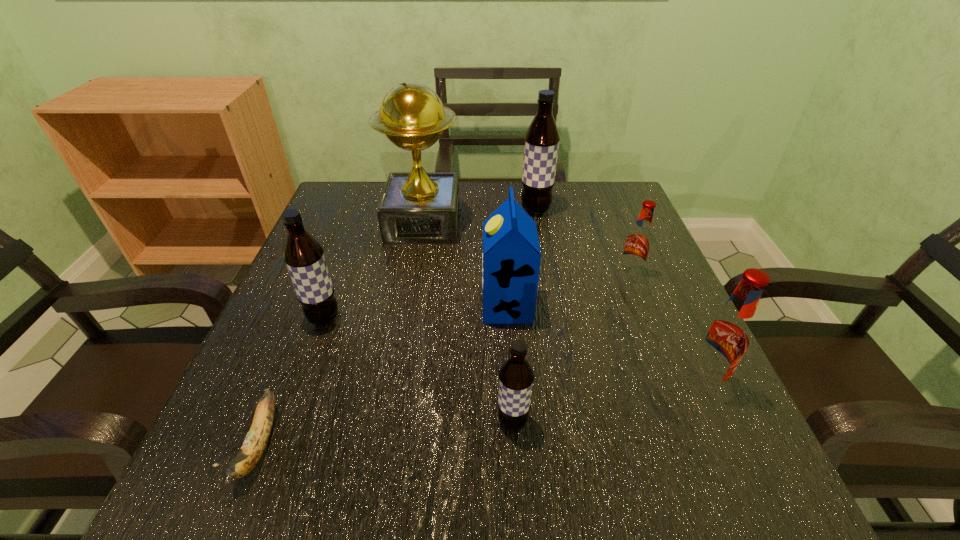
Identify the location of vacant space that is in between the third farthest object and the third root beer from right to left. Image resolution: width=960 pixels, height=540 pixels. (583, 242).

At what (x,y) coordinates should I click in order to perform the action: click on empty location between the carton and the leftmost brown root beer. Please return your answer as a coordinate pair (x, y). Looking at the image, I should click on (416, 312).

Select which object appears as the fifth closest to the leftmost root beer. Please provide its 2D coordinates. Your answer should be formatted as a tuple, i.e. [(x, y)], where the tuple contains the x and y coordinates of a point satisfying the conditions above.

[(542, 138)]

Select which object appears as the fourth closest to the shortest object. Please provide its 2D coordinates. Your answer should be formatted as a tuple, i.e. [(x, y)], where the tuple contains the x and y coordinates of a point satisfying the conditions above.

[(418, 207)]

In order to click on root beer that is the fourth closest one to the farthest root beer in this screenshot , I will do `click(516, 376)`.

What are the coordinates of `root beer that can be found as the fourth closest to the third farthest object` in the screenshot? It's located at (303, 255).

Point out which brown root beer is positioned as the nearest to the smallest brown root beer. Please provide its 2D coordinates. Your answer should be formatted as a tuple, i.e. [(x, y)], where the tuple contains the x and y coordinates of a point satisfying the conditions above.

[(303, 255)]

Locate an element on the screen. The image size is (960, 540). the second closest brown root beer to the shortest object is located at coordinates (516, 376).

Where is `vacant area in the image that satisfies the following two spatial constraints: 1. on the front side of the bigger red root beer; 2. on the right side of the third root beer from left to right`? vacant area in the image that satisfies the following two spatial constraints: 1. on the front side of the bigger red root beer; 2. on the right side of the third root beer from left to right is located at coordinates (565, 382).

Where is `vacant area that satisfies the following two spatial constraints: 1. on the back side of the rightmost brown root beer; 2. on the left side of the nearest root beer`? The image size is (960, 540). vacant area that satisfies the following two spatial constraints: 1. on the back side of the rightmost brown root beer; 2. on the left side of the nearest root beer is located at coordinates (499, 210).